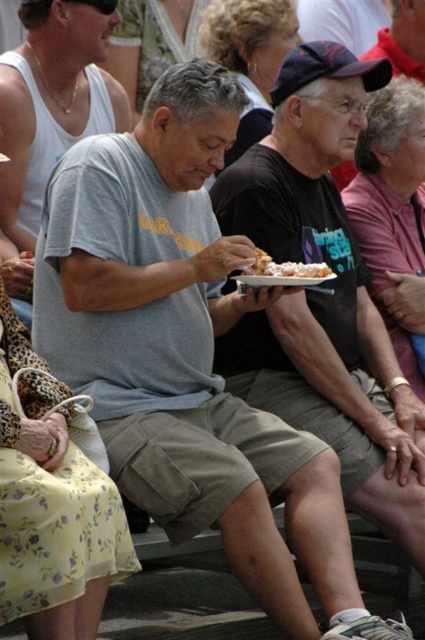
You are at the gathering and want to find the floral fabric dress at lower left. Based on its coordinates, which direction should you look relative to the two individuals in the foreground?

The floral fabric dress at lower left is located at point (51, 504), which means it is positioned to the right and slightly below the two individuals in the foreground. You should look towards the lower right direction from their position.